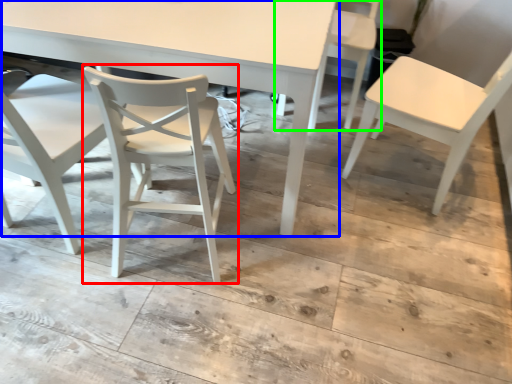
Question: Based on their relative distances, which object is nearer to chair (highlighted by a red box)? Choose from table (highlighted by a blue box) and chair (highlighted by a green box).

Choices:
 (A) table
 (B) chair

Answer: (A)